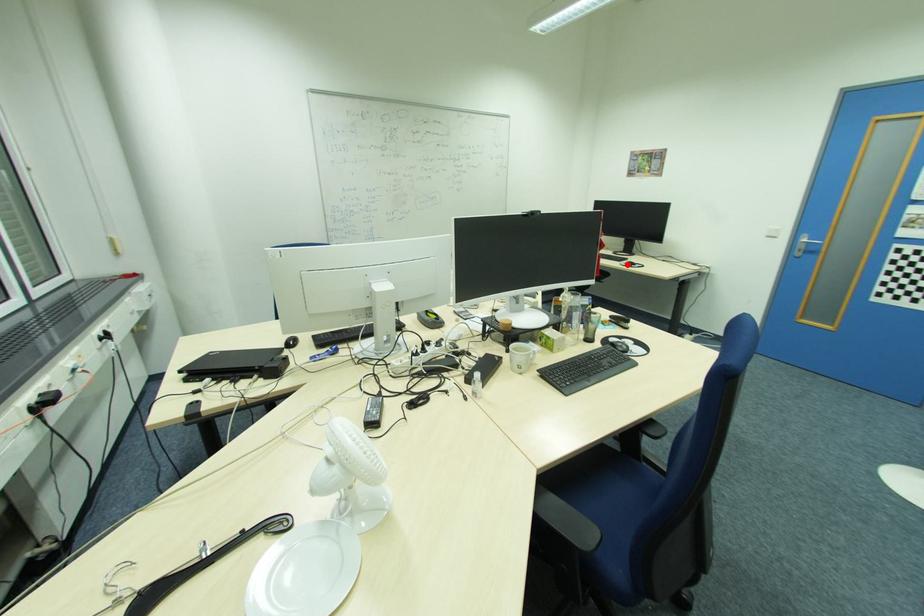
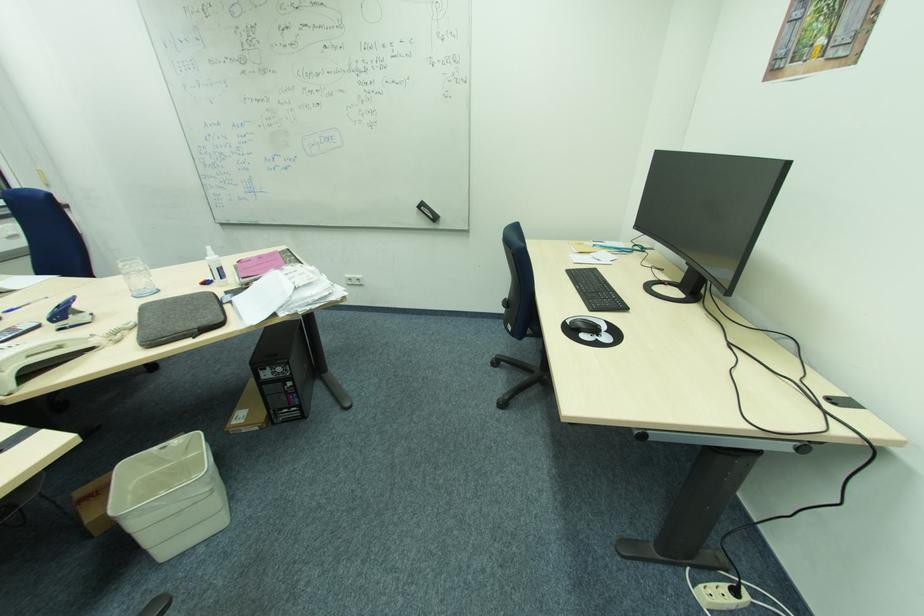
Find the pixel in the second image that matches the highlighted location in the first image.

(572, 323)